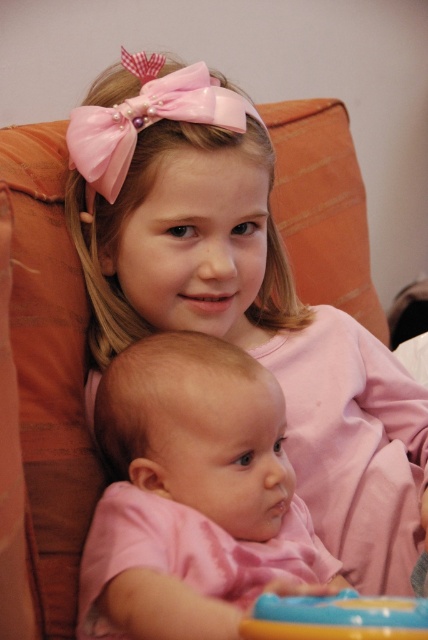
You are a photographer standing in front of the couch where the children are sitting. You want to take a closeup of the pink glossy bow at upper center. Considering your current position, is the bow within your reach to adjust its position before taking the photo?

The distance between the pink glossy bow at upper center and the viewer is 27.41 inches. Since this distance is within typical arm reach, the photographer can adjust the bow before taking the photo.

You are a photographer setting up for a family portrait. You have a pink satin baby at center and a smooth plastic toy at lower center in the scene. Which object should you focus on first if you want to capture the tallest subject in the image?

The pink satin baby at center is taller than the smooth plastic toy at lower center, so you should focus on the pink satin baby at center first to capture the tallest subject.